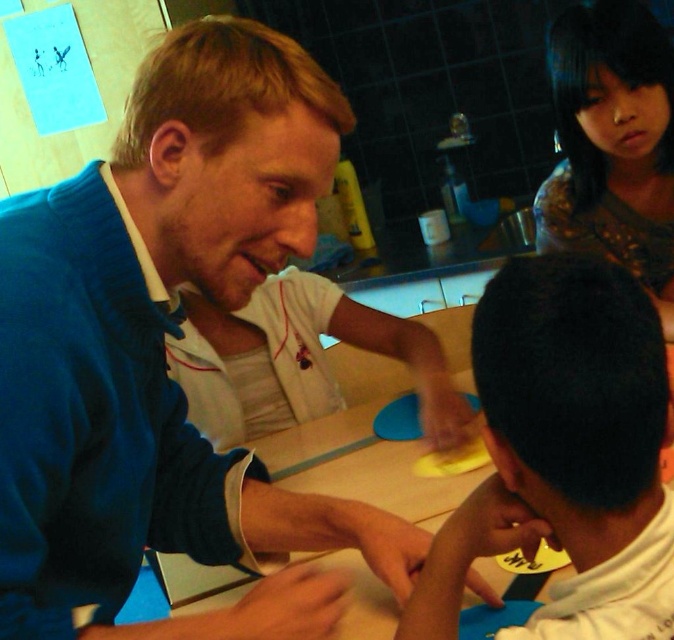
Question: Considering the relative positions of blue fleece jacket at upper left and smooth yellow paper at center in the image provided, where is blue fleece jacket at upper left located with respect to smooth yellow paper at center?

Choices:
 (A) left
 (B) right

Answer: (A)

Question: Among these objects, which one is nearest to the camera?

Choices:
 (A) matte brown hair at upper right
 (B) wooden table at center

Answer: (B)

Question: Is blue fleece jacket at upper left closer to camera compared to wooden table at center?

Choices:
 (A) yes
 (B) no

Answer: (A)

Question: Estimate the real-world distances between objects in this image. Which object is closer to the wooden table at center?

Choices:
 (A) matte brown hair at upper right
 (B) blue fleece jacket at upper left
 (C) smooth yellow paper at center

Answer: (B)

Question: Is blue fleece jacket at upper left further to camera compared to matte brown hair at upper right?

Choices:
 (A) yes
 (B) no

Answer: (B)

Question: Which object is the closest to the smooth yellow paper at center?

Choices:
 (A) blue fleece jacket at upper left
 (B) wooden table at center
 (C) matte brown hair at upper right

Answer: (A)